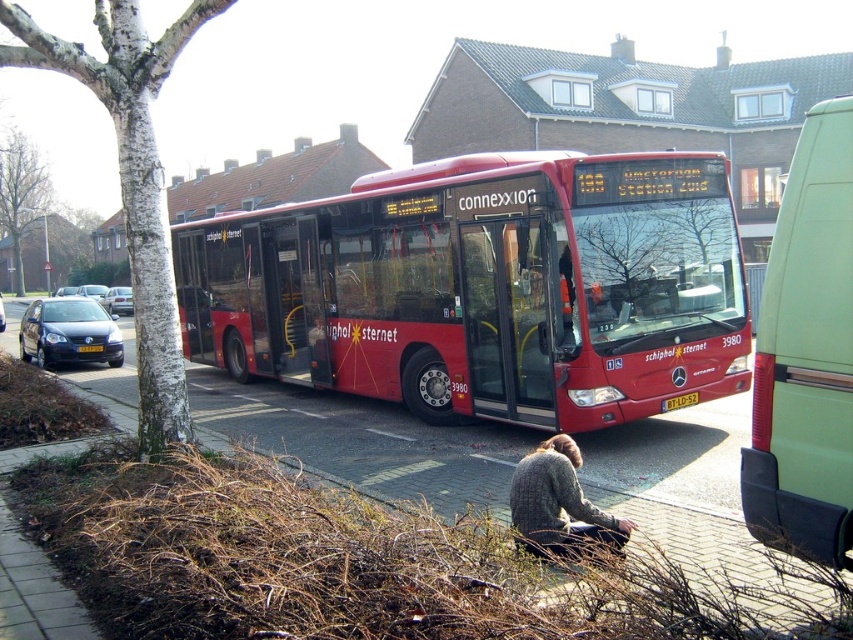
Question: Does green matte van at right appear over green leafy tree at left?

Choices:
 (A) no
 (B) yes

Answer: (A)

Question: Which object appears farthest from the camera in this image?

Choices:
 (A) red matte bus at center
 (B) green leafy tree at left
 (C) green matte van at right

Answer: (B)

Question: Which object is farther from the camera taking this photo?

Choices:
 (A) white bark tree at left
 (B) red matte bus at center
 (C) knitted sweater at lower center

Answer: (B)

Question: Does white bark tree at left have a larger size compared to green leafy tree at left?

Choices:
 (A) no
 (B) yes

Answer: (A)

Question: Can you confirm if green matte van at right is positioned to the left of shiny black car at left?

Choices:
 (A) yes
 (B) no

Answer: (B)

Question: Which object is the closest to the knitted sweater at lower center?

Choices:
 (A) white bark tree at left
 (B) shiny black car at left

Answer: (A)